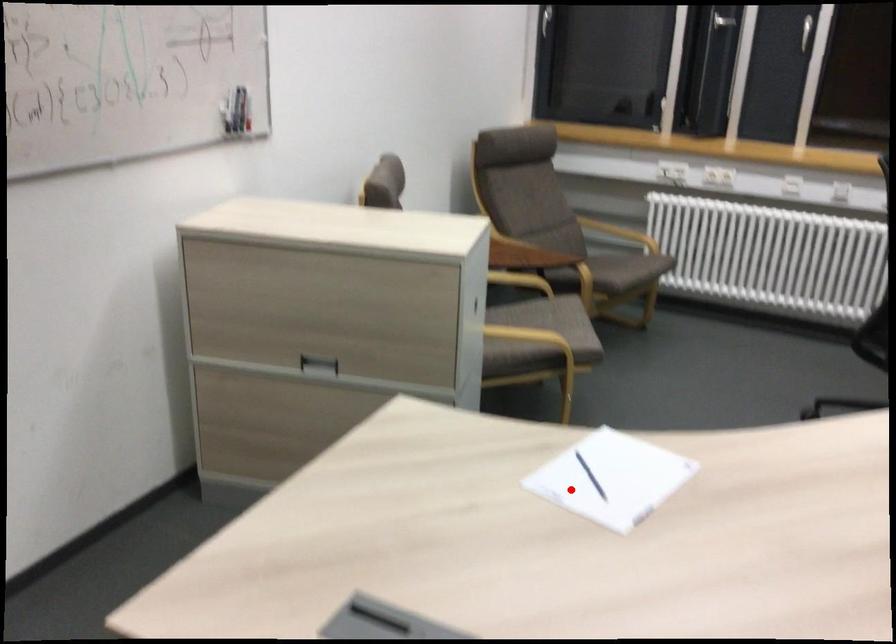
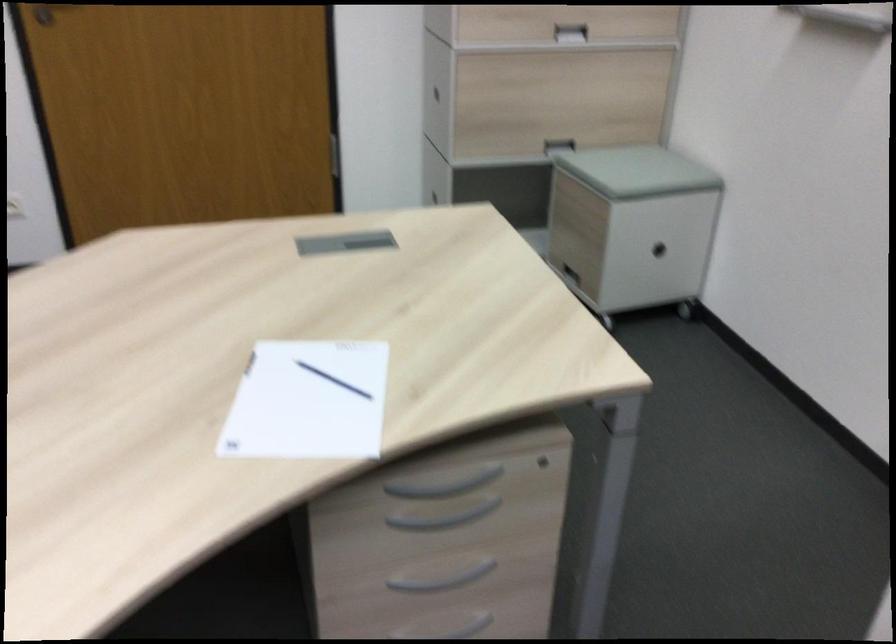
Question: I am providing you with two images of the same scene from different viewpoints. In image1, a red point is highlighted. Considering the same 3D point in image2, which of the following is correct?

Choices:
 (A) It is closer
 (B) It is farther

Answer: (A)